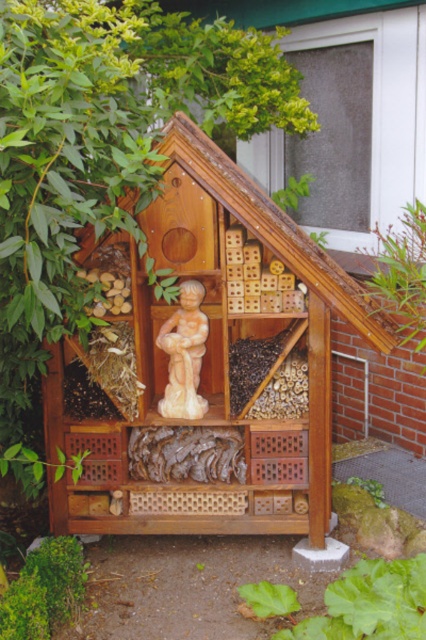
You are standing in front of the insect hotel and notice two items nearby. The green leafy plant at lower center and the beige stone statue at center. Which one is positioned to the right of the other?

The green leafy plant at lower center is positioned to the right of the beige stone statue at center.

Based on the photo, you are standing in front of the wooden insect hotel and notice two points marked on its structure. The first point is at coordinate point [391,568] and the second is at point [81,566]. Which of these points is closer to you?

Point [391,568] is closer to the viewer than point [81,566] according to the description.

Based on the photo, you are a gardener who wants to place a new small decorative item in the insect hotel. You have a tiny decorative rock and a small potted flower. Based on the sizes of the green leafy plant at lower center and beige stone statue at center, which item would be more appropriate to place near the smaller object?

The beige stone statue at center is smaller than the green leafy plant at lower center. Therefore, placing the tiny decorative rock near the beige stone statue at center would be more appropriate since it is smaller and matches the scale.